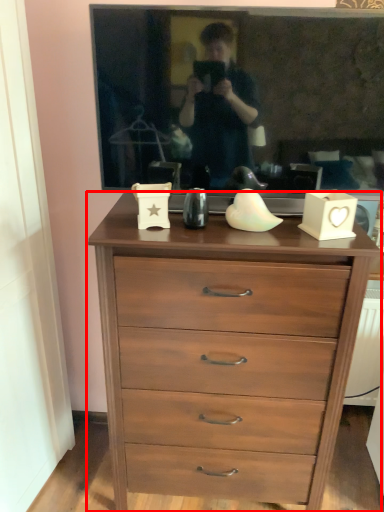
Question: From the image's perspective, what is the correct spatial relationship of chest of drawers (annotated by the red box) in relation to picture frame?

Choices:
 (A) above
 (B) below

Answer: (B)